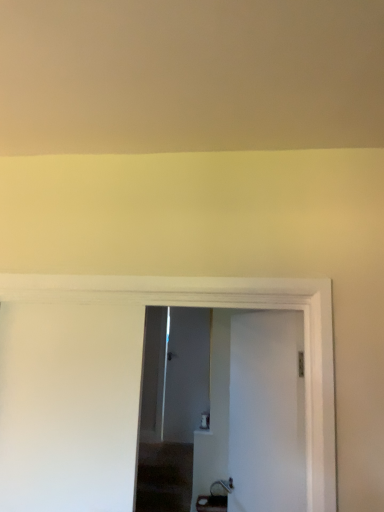
What do you see at coordinates (267, 412) in the screenshot? The height and width of the screenshot is (512, 384). I see `white matte door at center` at bounding box center [267, 412].

I want to click on white matte door at center, so click(x=267, y=412).

Measure the distance between point (248,475) and camera.

A distance of 2.07 meters exists between point (248,475) and camera.

The height and width of the screenshot is (512, 384). Identify the location of white matte door at center. (267, 412).